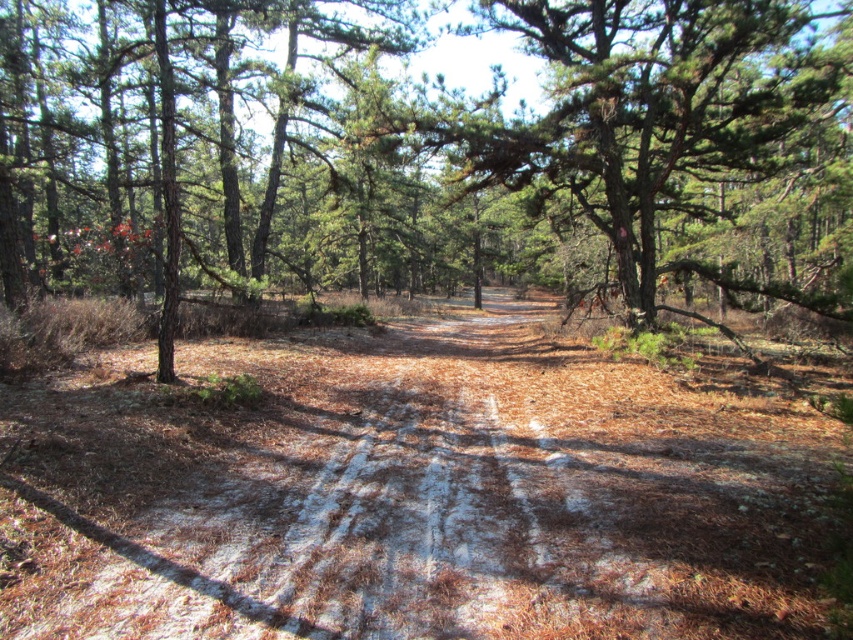
Who is positioned more to the right, brown dirt track at center or green rough bark tree at center?

From the viewer's perspective, green rough bark tree at center appears more on the right side.

Can you confirm if brown dirt track at center is bigger than green rough bark tree at center?

No.

Does point (682, 444) lie behind point (390, 132)?

No, (682, 444) is closer to viewer.

Find the location of a particular element. This screenshot has width=853, height=640. brown dirt track at center is located at coordinates (413, 492).